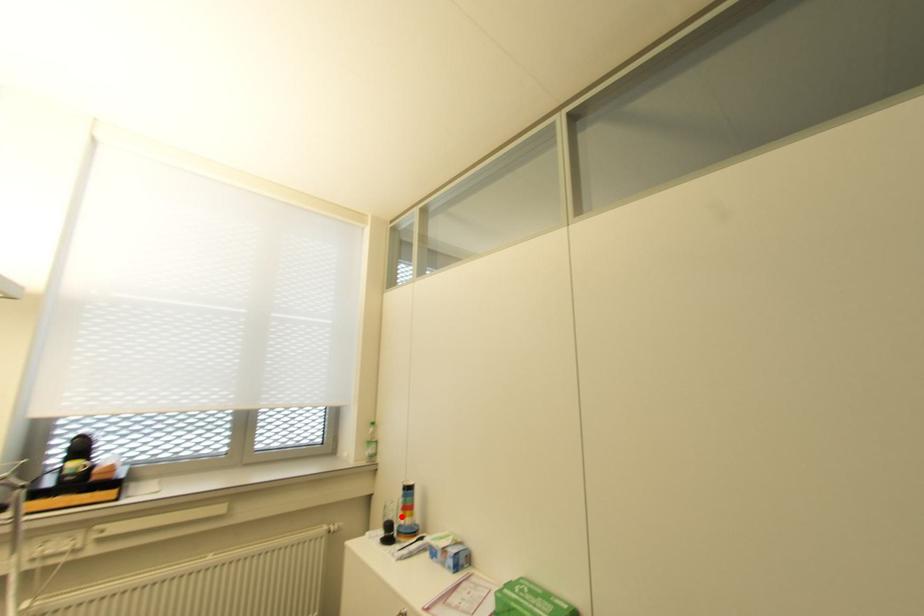
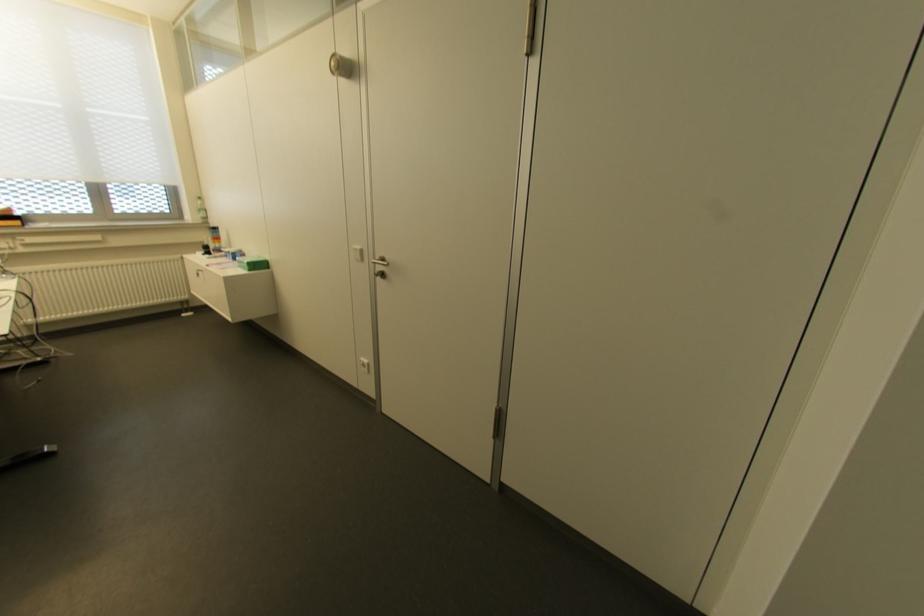
Question: I am providing you with two images of the same scene from different viewpoints. A red point is shown in image1. For the corresponding object point in image2, is it positioned nearer or farther from the camera?

Choices:
 (A) Nearer
 (B) Farther

Answer: (A)